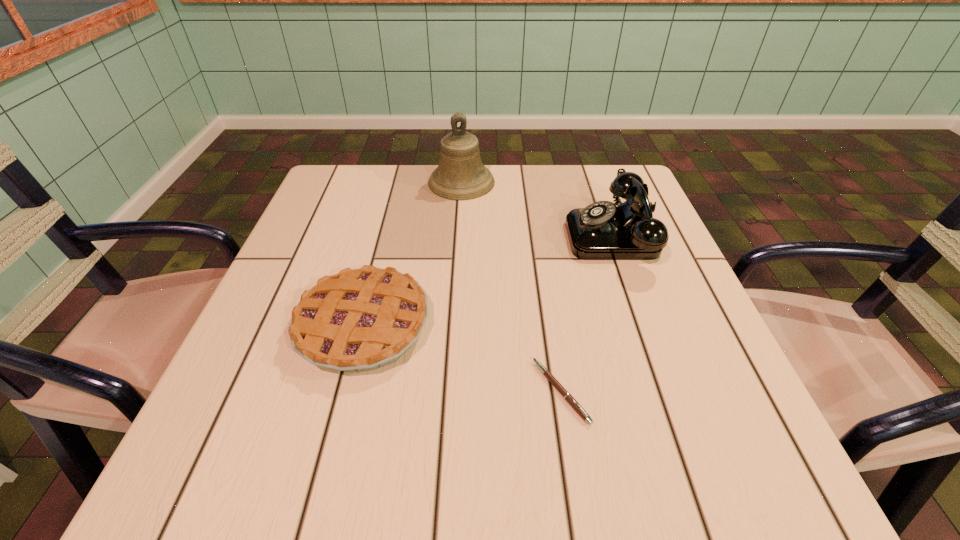
In order to click on vacant point located 0.380m on the dial of the third shortest object in this screenshot , I will do `click(400, 235)`.

The image size is (960, 540). Find the location of `vacant space located on the right of the second shortest object`. vacant space located on the right of the second shortest object is located at coordinates (550, 326).

Find the location of a particular element. Image resolution: width=960 pixels, height=540 pixels. free space located 0.240m at the nib of the pen is located at coordinates (385, 391).

Find the location of a particular element. The width and height of the screenshot is (960, 540). free space located at the nib of the pen is located at coordinates (454, 391).

The height and width of the screenshot is (540, 960). Identify the location of free space located at the nib of the pen. (423, 391).

In order to click on bell present at the far edge in this screenshot , I will do `click(460, 175)`.

Locate an element on the screen. The height and width of the screenshot is (540, 960). telephone at the far edge is located at coordinates (603, 230).

I want to click on object present at the left edge, so click(362, 319).

Where is `object at the right edge`? The width and height of the screenshot is (960, 540). object at the right edge is located at coordinates (603, 230).

Where is `object that is at the far right corner`? The height and width of the screenshot is (540, 960). object that is at the far right corner is located at coordinates (603, 230).